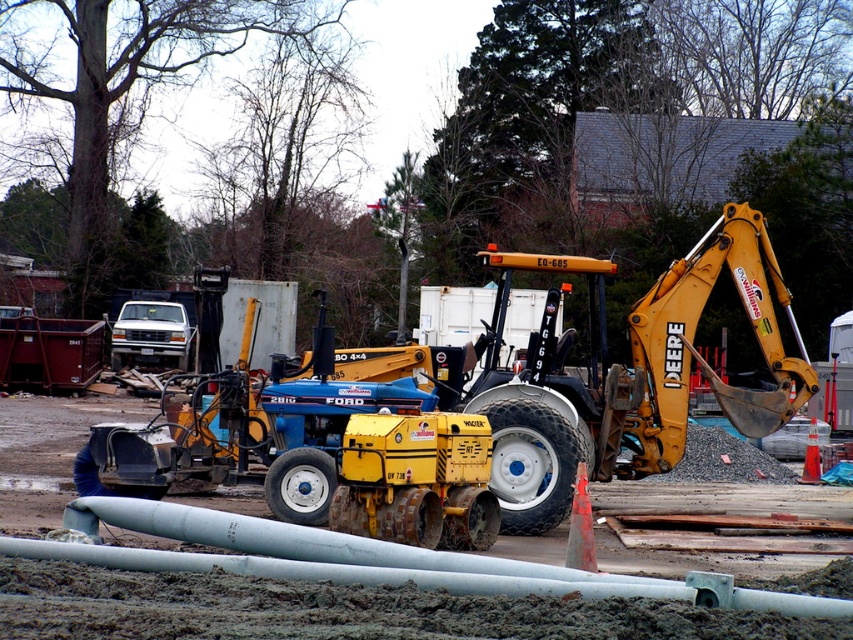
Between yellow rubber tractor at center and yellow metal excavator at center right, which one appears on the left side from the viewer's perspective?

Positioned to the left is yellow rubber tractor at center.

Which is behind, point (496, 522) or point (579, 403)?

Positioned behind is point (579, 403).

The height and width of the screenshot is (640, 853). I want to click on yellow rubber tractor at center, so click(317, 444).

You are a GUI agent. You are given a task and a screenshot of the screen. Output one action in this format:
    pyautogui.click(x=<x>, y=<y>)
    Task: Click on the yellow rubber tractor at center
    This screenshot has width=853, height=640.
    Given the screenshot: What is the action you would take?
    pyautogui.click(x=317, y=444)